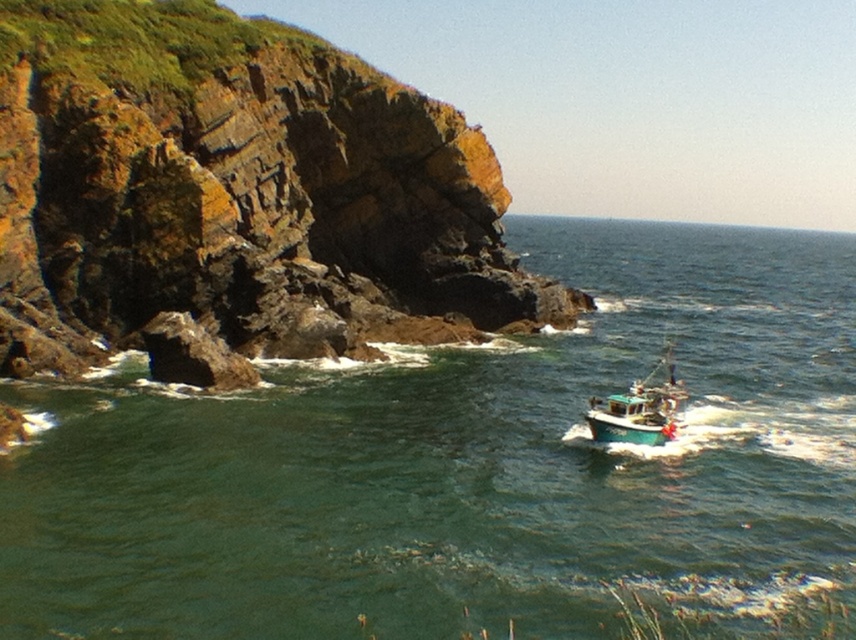
You are standing on a cliff overlooking the green water at lower center and the rusty rock at left. Which object is higher in elevation?

The green water at lower center is much taller than the rusty rock at left, so it has a higher elevation.

You are standing at the edge of the cliff looking out at the sea. There are two points marked in the image. Which point, point (794, 563) or point (289, 42), is closer to you?

Point (794, 563) is closer to you than point (289, 42).